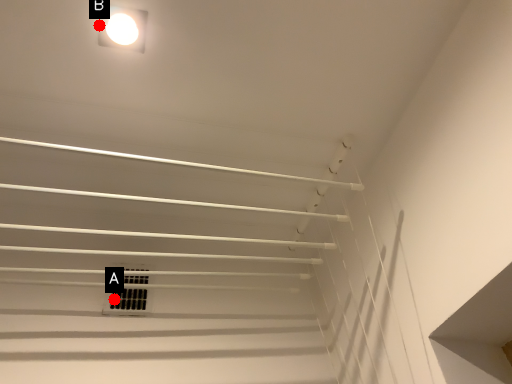
Question: Two points are circled on the image, labeled by A and B beside each circle. Which of the following is the farthest from the observer?

Choices:
 (A) A is further
 (B) B is further

Answer: (A)